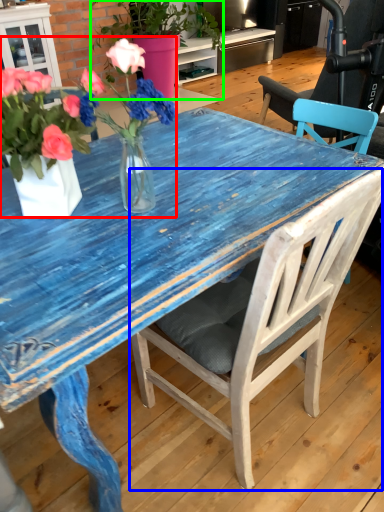
Question: Considering the real-world distances, which object is closest to floral arrangement (highlighted by a red box)? chair (highlighted by a blue box) or houseplant (highlighted by a green box).

Choices:
 (A) chair
 (B) houseplant

Answer: (A)